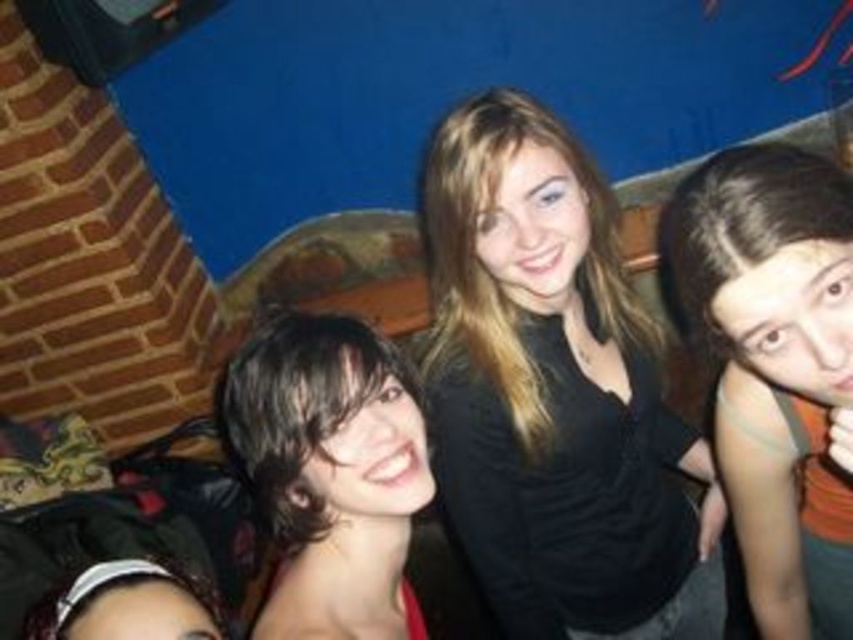
From the picture: Is black matte shirt at center to the left of dark brown hair at right from the viewer's perspective?

Yes, black matte shirt at center is to the left of dark brown hair at right.

Is black matte shirt at center above dark brown hair at right?

Yes.

Is point (598, 378) positioned before point (805, 378)?

That is False.

Find the location of a particular element. The width and height of the screenshot is (853, 640). black matte shirt at center is located at coordinates (553, 392).

Image resolution: width=853 pixels, height=640 pixels. I want to click on black matte shirt at center, so click(x=553, y=392).

Can you confirm if black matte shirt at center is taller than dark brown hair at center?

Correct, black matte shirt at center is much taller as dark brown hair at center.

Is point (554, 548) more distant than point (380, 372)?

Yes, point (554, 548) is farther from viewer.

Where is `black matte shirt at center`? black matte shirt at center is located at coordinates (553, 392).

Can you confirm if black matte shirt at center is bigger than matte black hair at lower left?

Yes, black matte shirt at center is bigger than matte black hair at lower left.

Is point (492, 218) positioned after point (76, 627)?

Yes, it is behind point (76, 627).

The height and width of the screenshot is (640, 853). What do you see at coordinates (553, 392) in the screenshot?
I see `black matte shirt at center` at bounding box center [553, 392].

Image resolution: width=853 pixels, height=640 pixels. Find the location of `black matte shirt at center`. black matte shirt at center is located at coordinates (553, 392).